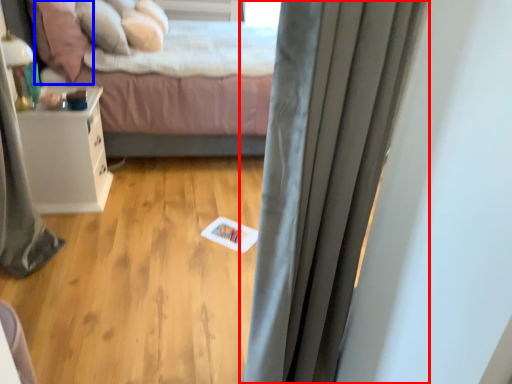
Question: Which object is further to the camera taking this photo, curtain (highlighted by a red box) or pillow (highlighted by a blue box)?

Choices:
 (A) curtain
 (B) pillow

Answer: (B)